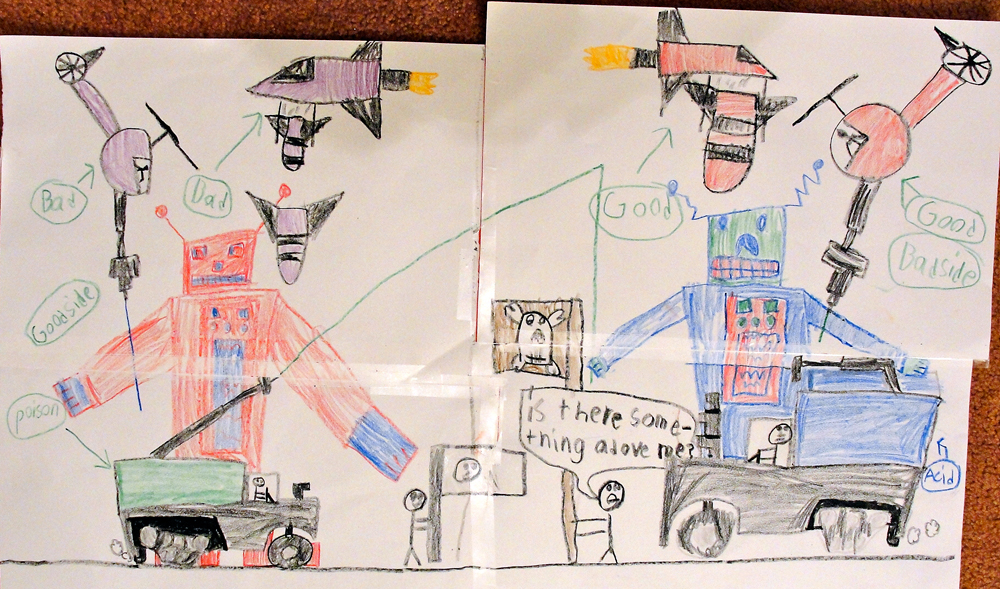
You are a GUI agent. You are given a task and a screenshot of the screen. Output one action in this format:
    pyautogui.click(x=<x>, y=<y>)
    Task: Click on the clear scotch tape
    This screenshot has height=589, width=1000.
    Given the screenshot: What is the action you would take?
    pyautogui.click(x=182, y=375), pyautogui.click(x=426, y=383), pyautogui.click(x=462, y=274), pyautogui.click(x=491, y=227), pyautogui.click(x=482, y=465), pyautogui.click(x=661, y=350)